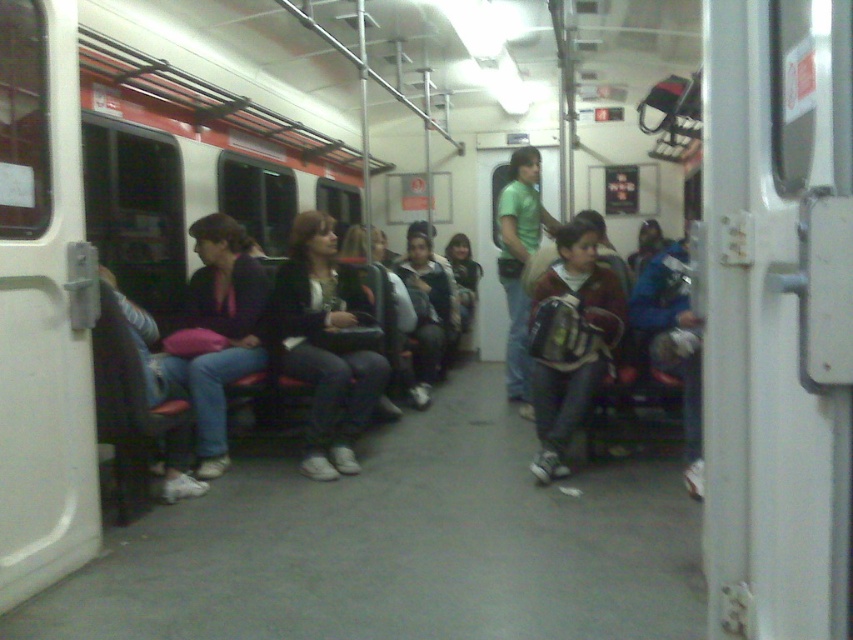
You are a subway passenger who wants to sit down. You notice the matte black jacket at center and the green matte shirt at center. Which object is wider so that you can choose a seat with enough space?

The matte black jacket at center is wider than the green matte shirt at center, so choosing a seat near the matte black jacket at center might provide more space.

You are standing in the subway car and need to place a new bench. The bench will be placed at the point with coordinates [572,340]. Is there enough space to place the bench there?

The point [572,340] is occupied by a dark brown backpack at center, so there is no space to place the bench there.